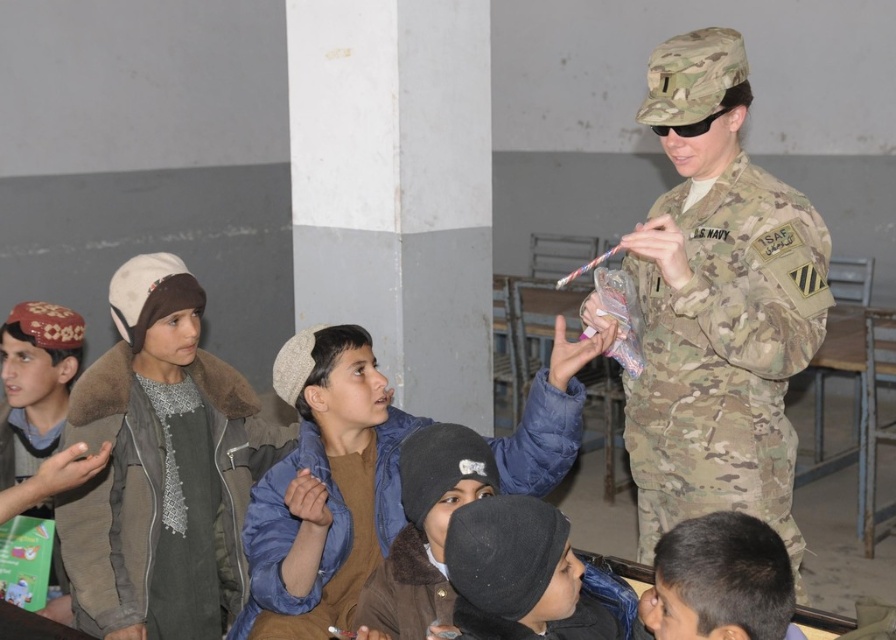
You are a parent trying to locate your child in the classroom. You see the camouflage fabric uniform at center and the dark brown hair at lower right. Which one is closer to the front of the room?

The camouflage fabric uniform at center is taller than dark brown hair at lower right, so it is closer to the front of the room.

You are standing at the center of the classroom and want to move to the camouflage uniform at right. According to the coordinates provided, in which direction should you move to reach it?

The camouflage uniform at right is located at coordinates point (718, 305). Since you are at the center, you should move towards the right side of the classroom to reach it.

You are a student in the classroom and want to know if the camouflage fabric uniform at center is wider than the dark brown hair at lower right. Can you determine this based on the scene?

The camouflage fabric uniform at center is wider than the dark brown hair at lower right according to the description.